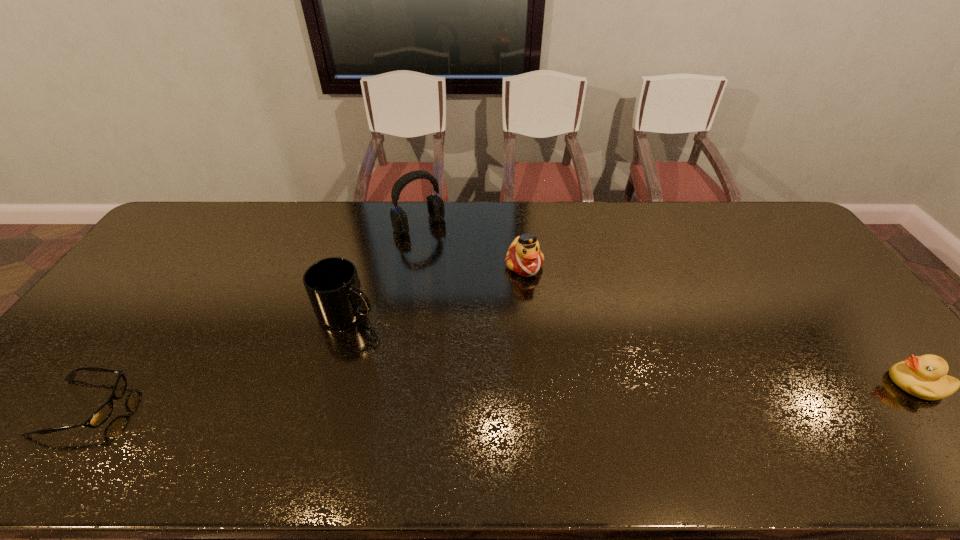
The width and height of the screenshot is (960, 540). Find the location of `free space located 0.360m on the front-facing side of the second shortest object`. free space located 0.360m on the front-facing side of the second shortest object is located at coordinates (748, 383).

You are a GUI agent. You are given a task and a screenshot of the screen. Output one action in this format:
    pyautogui.click(x=<x>, y=<y>)
    Task: Click on the vacant region located on the front-facing side of the second shortest object
    The height and width of the screenshot is (540, 960).
    Given the screenshot: What is the action you would take?
    pyautogui.click(x=772, y=383)

This screenshot has width=960, height=540. In order to click on blank space located on the front-facing side of the second shortest object in this screenshot , I will do `click(812, 383)`.

Locate an element on the screen. The height and width of the screenshot is (540, 960). vacant point located 0.390m on the face of the fourth object from left to right is located at coordinates (595, 383).

The image size is (960, 540). I want to click on free spot located 0.270m on the face of the fourth object from left to right, so click(x=573, y=347).

This screenshot has width=960, height=540. What are the coordinates of `vacant space located 0.170m on the face of the fourth object from left to right` in the screenshot? It's located at (557, 320).

This screenshot has height=540, width=960. In order to click on free space located 0.120m with the handle on the side of the third nearest object in this screenshot , I will do `click(396, 346)`.

The image size is (960, 540). What are the coordinates of `free space located 0.120m with the handle on the side of the third nearest object` in the screenshot? It's located at (396, 346).

The image size is (960, 540). What are the coordinates of `free space located with the handle on the side of the third nearest object` in the screenshot? It's located at click(x=389, y=340).

Where is `vacant area situated 0.060m on the headband of the tallest object`? vacant area situated 0.060m on the headband of the tallest object is located at coordinates click(x=441, y=245).